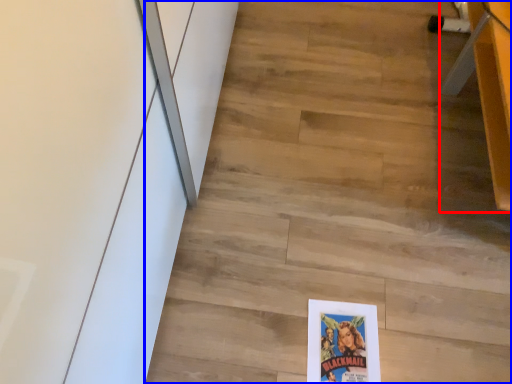
Question: Which object is closer to the camera taking this photo, furniture (highlighted by a red box) or stair (highlighted by a blue box)?

Choices:
 (A) furniture
 (B) stair

Answer: (A)